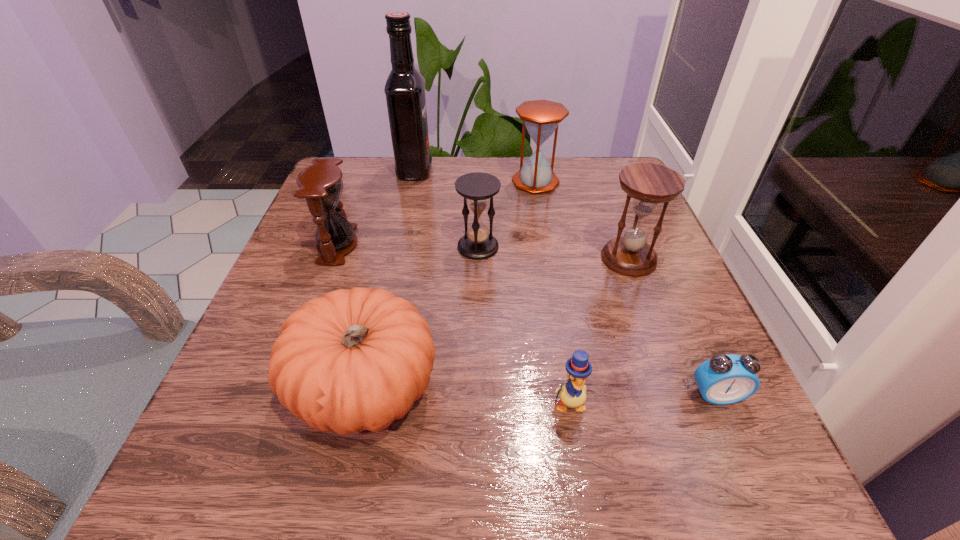
I want to click on hourglass that is the second closest to the leftmost hourglass, so click(x=541, y=118).

Locate an element on the screen. hourglass that is the closest one to the rightmost hourglass is located at coordinates (541, 118).

This screenshot has height=540, width=960. In order to click on free spot that satisfies the following two spatial constraints: 1. on the back side of the third hourglass from right to left; 2. on the front-facing side of the tallest object in this screenshot , I will do `click(478, 171)`.

Locate an element on the screen. vacant area that satisfies the following two spatial constraints: 1. on the front side of the rightmost hourglass; 2. on the left side of the leftmost hourglass is located at coordinates (332, 259).